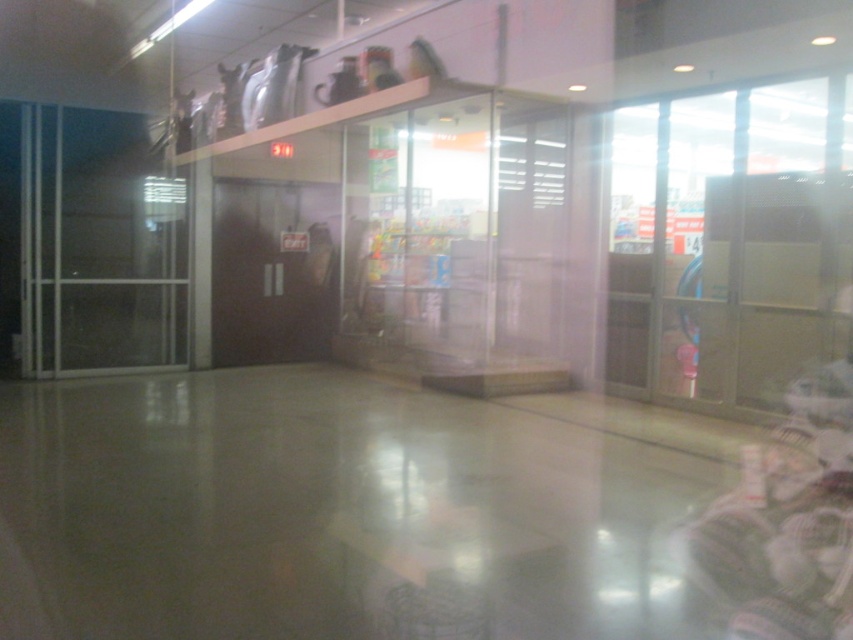
Does transparent plastic glass door at right appear over transparent glass door at left?

No, transparent plastic glass door at right is not above transparent glass door at left.

The height and width of the screenshot is (640, 853). Describe the element at coordinates (729, 243) in the screenshot. I see `transparent plastic glass door at right` at that location.

Locate an element on the screen. transparent plastic glass door at right is located at coordinates (729, 243).